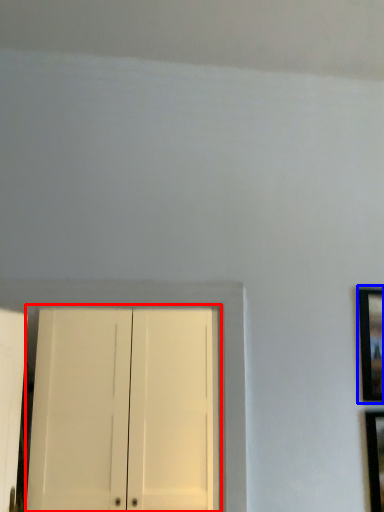
Question: Among these objects, which one is nearest to the camera, door (highlighted by a red box) or picture frame (highlighted by a blue box)?

Choices:
 (A) door
 (B) picture frame

Answer: (B)